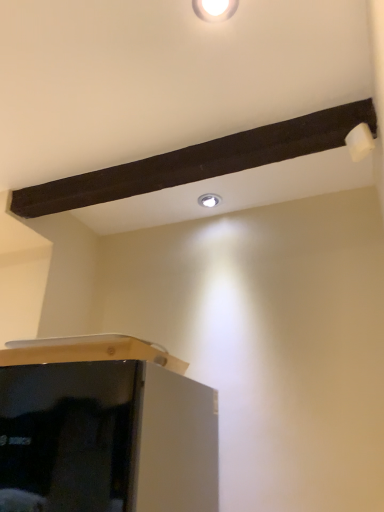
Question: Is point (205, 199) closer or farther from the camera than point (198, 3)?

Choices:
 (A) closer
 (B) farther

Answer: (B)

Question: From the image's perspective, relative to white glossy light fixture at upper center, is white glossy droplight at upper center above or below?

Choices:
 (A) above
 (B) below

Answer: (B)

Question: Considering the positions of white glossy droplight at upper center and white glossy light fixture at upper center in the image, is white glossy droplight at upper center wider or thinner than white glossy light fixture at upper center?

Choices:
 (A) wide
 (B) thin

Answer: (B)

Question: Does point (221, 10) appear closer or farther from the camera than point (203, 201)?

Choices:
 (A) farther
 (B) closer

Answer: (B)

Question: From a real-world perspective, is white glossy light fixture at upper center above or below white glossy droplight at upper center?

Choices:
 (A) above
 (B) below

Answer: (B)

Question: From the image's perspective, is white glossy light fixture at upper center positioned above or below white glossy droplight at upper center?

Choices:
 (A) above
 (B) below

Answer: (A)

Question: Is white glossy light fixture at upper center wider or thinner than white glossy droplight at upper center?

Choices:
 (A) wide
 (B) thin

Answer: (A)